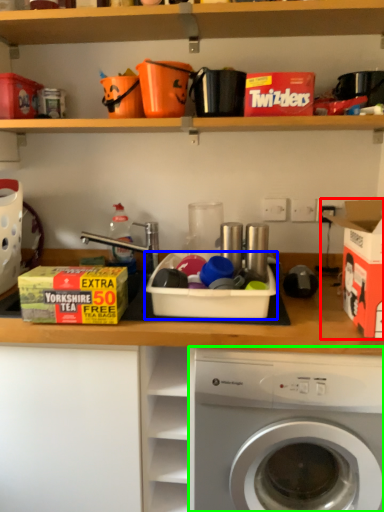
Question: Which is nearer to the storage box (highlighted by a red box)? storage box (highlighted by a blue box) or washing machine (highlighted by a green box).

Choices:
 (A) storage box
 (B) washing machine

Answer: (A)